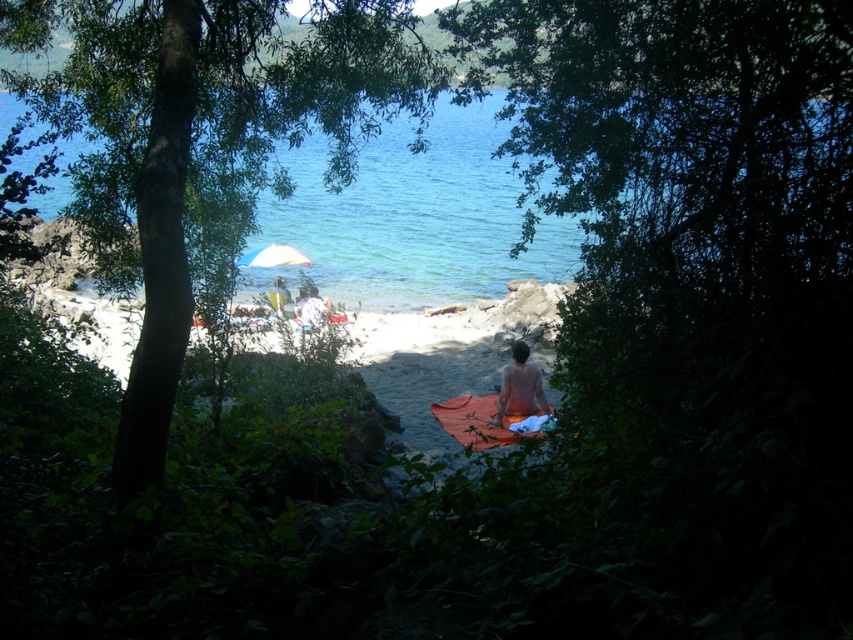
Question: Where is shiny brown towel at center located in relation to white fabric umbrella at center in the image?

Choices:
 (A) above
 (B) below

Answer: (B)

Question: Which object is closer to the camera taking this photo?

Choices:
 (A) clear blue water at center
 (B) orange fabric towel at center

Answer: (B)

Question: Is clear blue water at center positioned at the back of orange fabric towel at center?

Choices:
 (A) yes
 (B) no

Answer: (A)

Question: Is green leafy tree at center to the right of orange fabric towel at center from the viewer's perspective?

Choices:
 (A) no
 (B) yes

Answer: (A)

Question: Which of the following is the closest to the observer?

Choices:
 (A) (78, 138)
 (B) (96, 314)

Answer: (B)

Question: Which point is closer to the camera taking this photo?

Choices:
 (A) (252, 104)
 (B) (537, 392)

Answer: (A)